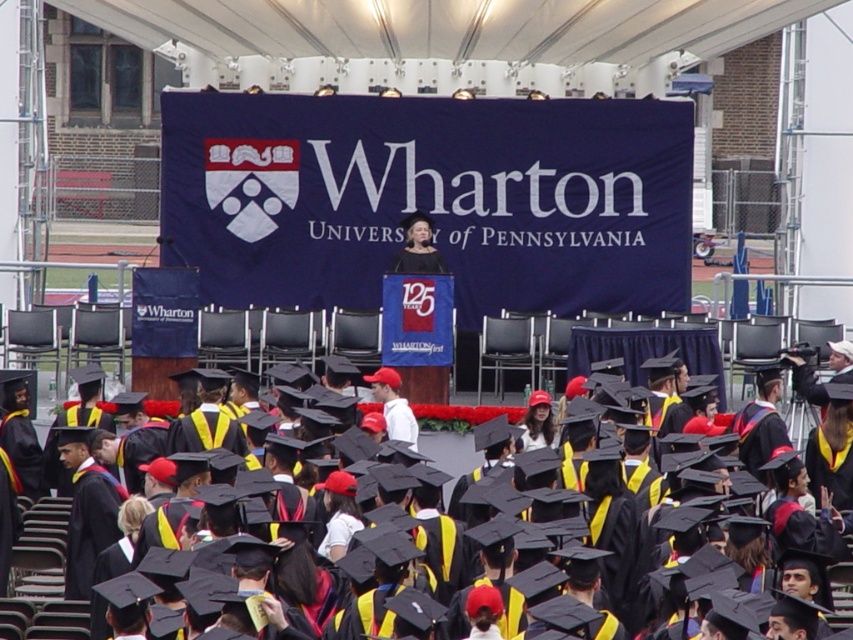
Question: Is black matte graduation cap at center positioned behind matte black dress at center?

Choices:
 (A) no
 (B) yes

Answer: (A)

Question: Which point is farther to the camera?

Choices:
 (A) (44, 566)
 (B) (405, 264)

Answer: (B)

Question: Among these objects, which one is farthest from the camera?

Choices:
 (A) matte black dress at center
 (B) black matte graduation cap at center

Answer: (A)

Question: Can you confirm if black matte graduation cap at center is positioned below matte black dress at center?

Choices:
 (A) no
 (B) yes

Answer: (B)

Question: Can you confirm if black matte graduation cap at center is wider than matte black dress at center?

Choices:
 (A) no
 (B) yes

Answer: (B)